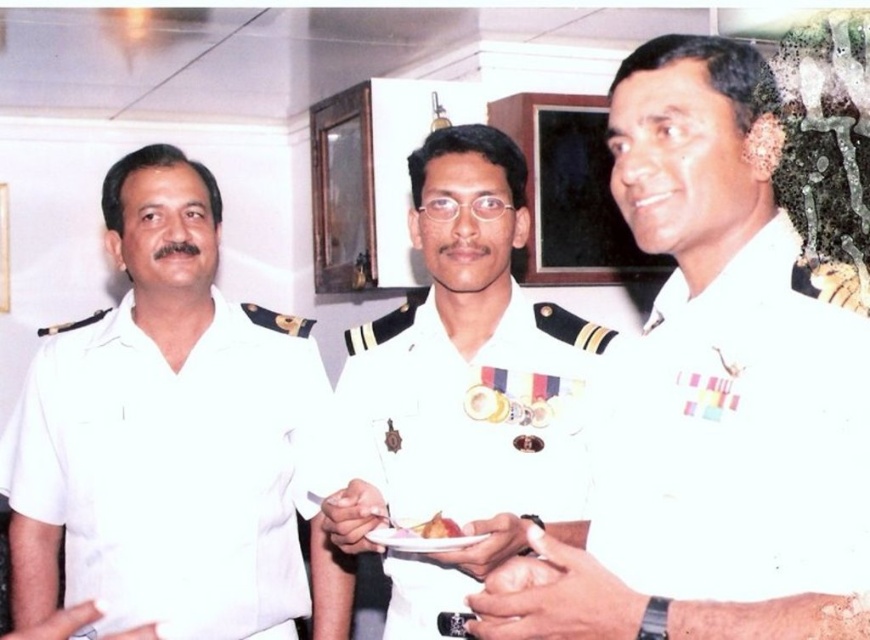
Based on the scene description, where is the white glossy uniform at center located in terms of its 2D coordinates?

The white glossy uniform at center is located at the 2D coordinates point (472,412).

You are a photographer at a formal event. You need to capture a photo of the white glossy uniform at center and the white paper plate at center. Which object should you focus on first if you want to ensure both are in frame without moving the camera?

The white glossy uniform at center is bigger than the white paper plate at center, so you should focus on the white glossy uniform at center first to ensure both fit within the frame.

You are a guest at this naval ceremony and want to grab a snack. The white paper plate at center and the smooth brown cake at center are both in front of you. Which one can you reach without moving your chair?

The white paper plate at center is closer to the viewer than the smooth brown cake at center, so you can reach the white paper plate at center without moving your chair.